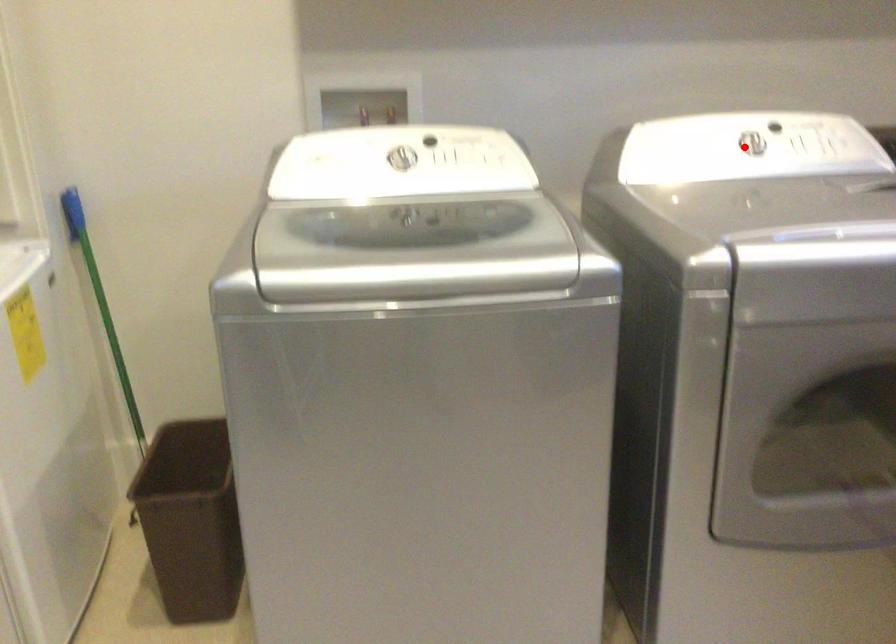
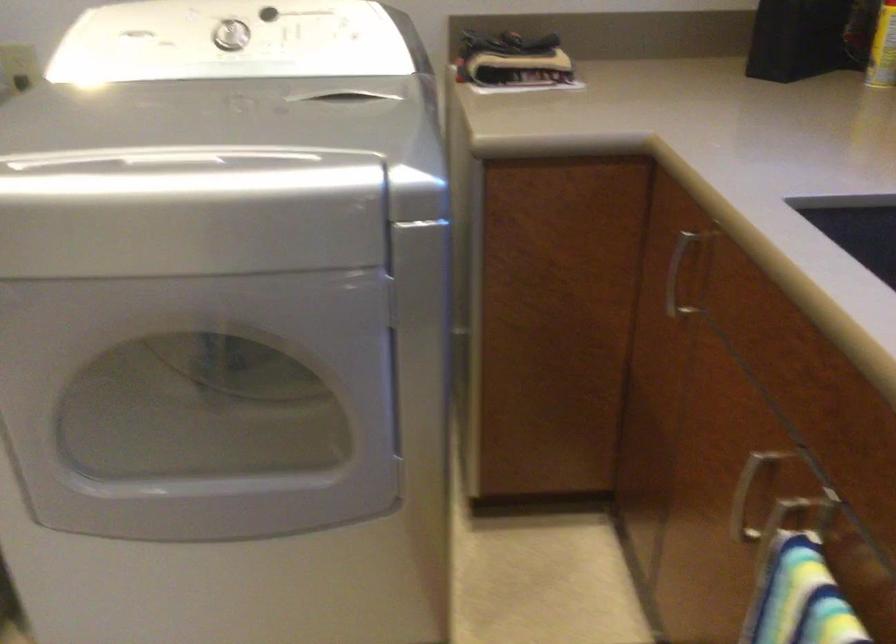
Question: I am providing you with two images of the same scene from different viewpoints. Given a red point in image1, look at the same physical point in image2. Is it:

Choices:
 (A) Closer to the viewpoint
 (B) Farther from the viewpoint

Answer: (A)